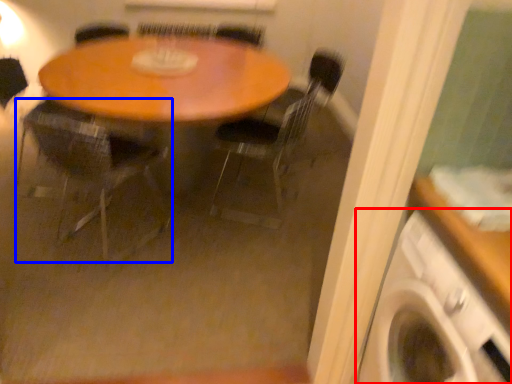
Question: Which object appears closest to the camera in this image, washing machine (highlighted by a red box) or chair (highlighted by a blue box)?

Choices:
 (A) washing machine
 (B) chair

Answer: (A)